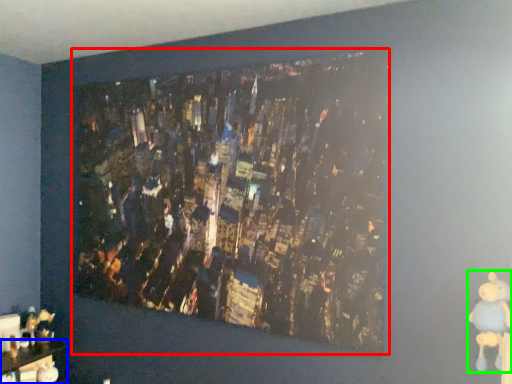
Question: Which is nearer to the picture frame (highlighted by a red box)? furniture (highlighted by a blue box) or toy (highlighted by a green box).

Choices:
 (A) furniture
 (B) toy

Answer: (B)